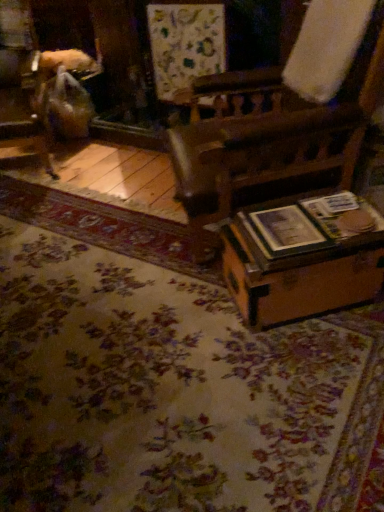
Question: From a real-world perspective, is wooden chair at left on top of wooden trunk at lower right?

Choices:
 (A) yes
 (B) no

Answer: (A)

Question: Can you confirm if wooden chair at left is shorter than wooden trunk at lower right?

Choices:
 (A) no
 (B) yes

Answer: (A)

Question: Is the depth of wooden chair at left greater than that of wooden trunk at lower right?

Choices:
 (A) yes
 (B) no

Answer: (A)

Question: Considering the relative sizes of wooden chair at left and wooden trunk at lower right in the image provided, is wooden chair at left thinner than wooden trunk at lower right?

Choices:
 (A) yes
 (B) no

Answer: (B)

Question: Is wooden chair at left taller than wooden trunk at lower right?

Choices:
 (A) yes
 (B) no

Answer: (A)

Question: Is wooden chair at left positioned beyond the bounds of wooden trunk at lower right?

Choices:
 (A) yes
 (B) no

Answer: (A)

Question: Is floral carpet at center behind wooden chair at left?

Choices:
 (A) no
 (B) yes

Answer: (A)

Question: Is floral carpet at center wider than wooden chair at left?

Choices:
 (A) yes
 (B) no

Answer: (A)

Question: Is floral carpet at center at the left side of wooden chair at left?

Choices:
 (A) yes
 (B) no

Answer: (B)

Question: Is floral carpet at center positioned beyond the bounds of wooden chair at left?

Choices:
 (A) no
 (B) yes

Answer: (B)

Question: Is wooden chair at left at the back of floral carpet at center?

Choices:
 (A) yes
 (B) no

Answer: (B)

Question: From a real-world perspective, is floral carpet at center beneath wooden chair at left?

Choices:
 (A) yes
 (B) no

Answer: (A)

Question: Could you tell me if floral carpet at center is facing wooden trunk at lower right?

Choices:
 (A) yes
 (B) no

Answer: (B)